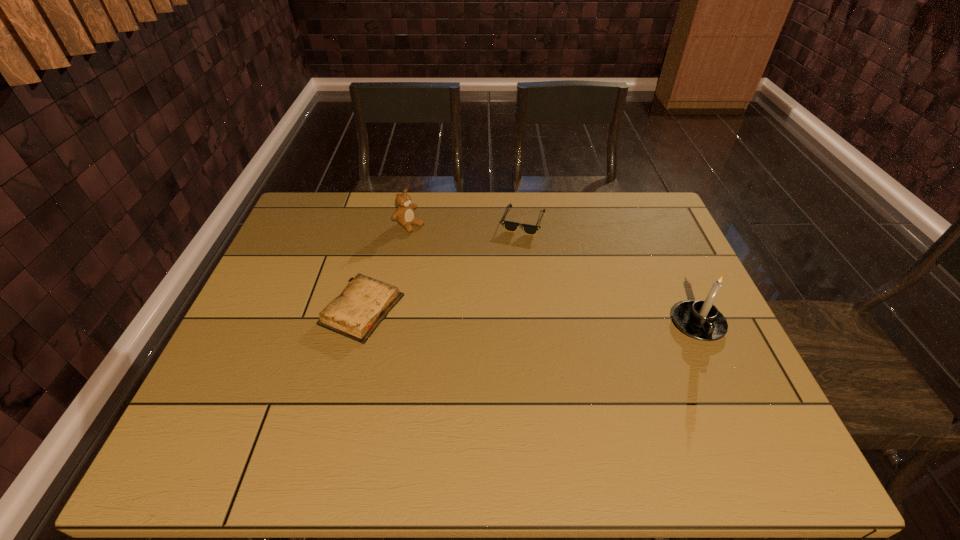
Locate an element on the screen. object that is the second closest one to the second tallest object is located at coordinates (508, 225).

Identify which object is located as the third nearest to the candle holder. Please provide its 2D coordinates. Your answer should be formatted as a tuple, i.e. [(x, y)], where the tuple contains the x and y coordinates of a point satisfying the conditions above.

[(404, 215)]

I want to click on blank area in the image that satisfies the following two spatial constraints: 1. on the back side of the second object from right to left; 2. on the left side of the teddy bear, so click(410, 221).

You are a GUI agent. You are given a task and a screenshot of the screen. Output one action in this format:
    pyautogui.click(x=<x>, y=<y>)
    Task: Click on the vacant area in the image that satisfies the following two spatial constraints: 1. on the back side of the diary; 2. on the left side of the third object from left to right
    
    Given the screenshot: What is the action you would take?
    pyautogui.click(x=385, y=221)